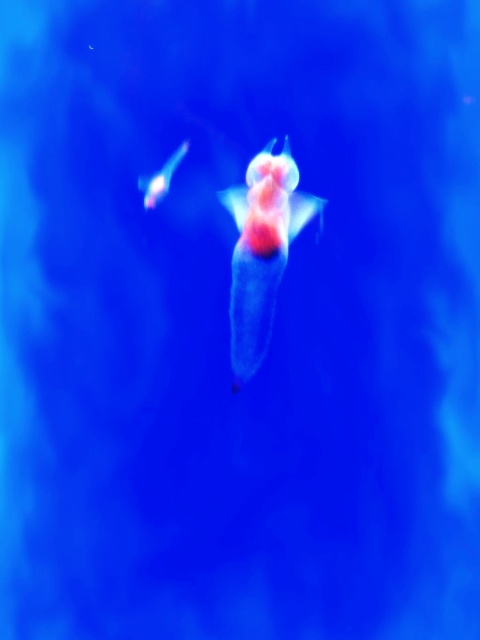
Question: Can you confirm if translucent blue fish at center is positioned above matte pink fish at upper left?

Choices:
 (A) yes
 (B) no

Answer: (B)

Question: Among these points, which one is farthest from the camera?

Choices:
 (A) (237, 390)
 (B) (144, 186)

Answer: (B)

Question: Can you confirm if translucent blue fish at center is bigger than matte pink fish at upper left?

Choices:
 (A) yes
 (B) no

Answer: (A)

Question: Does translucent blue fish at center have a greater width compared to matte pink fish at upper left?

Choices:
 (A) no
 (B) yes

Answer: (B)

Question: Among these objects, which one is nearest to the camera?

Choices:
 (A) translucent blue fish at center
 (B) matte pink fish at upper left

Answer: (A)